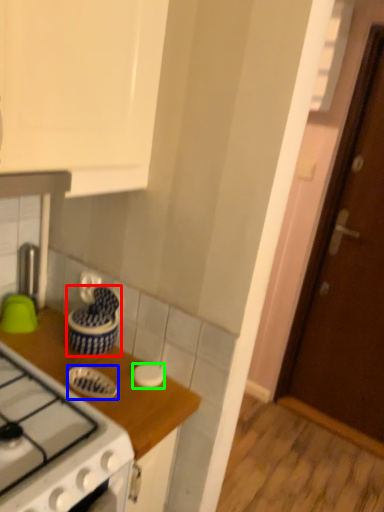
Question: Which is nearer to the kitchen appliance (highlighted by a red box)? kitchen appliance (highlighted by a blue box) or kitchen appliance (highlighted by a green box).

Choices:
 (A) kitchen appliance
 (B) kitchen appliance

Answer: (A)